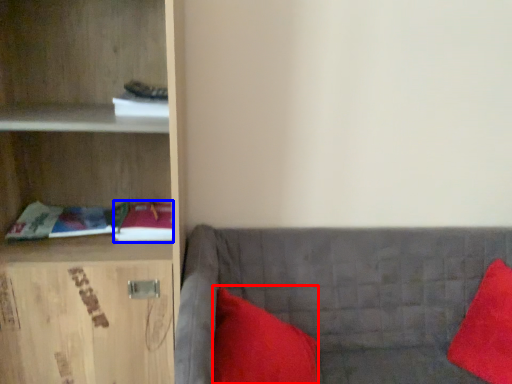
Question: Among these objects, which one is nearest to the camera, pillow (highlighted by a red box) or book (highlighted by a blue box)?

Choices:
 (A) pillow
 (B) book

Answer: (A)